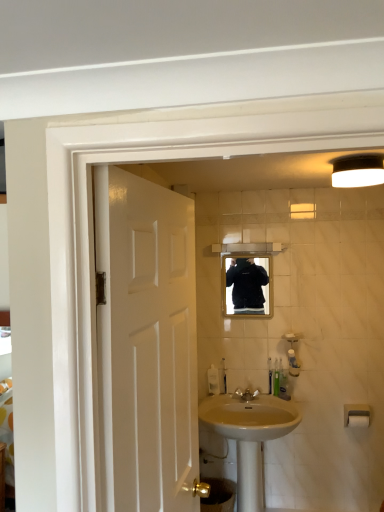
What do you see at coordinates (358, 419) in the screenshot?
I see `white plastic towel bar at lower right, which appears as the second towel bar when viewed from the top` at bounding box center [358, 419].

The width and height of the screenshot is (384, 512). What do you see at coordinates (223, 377) in the screenshot? I see `white plastic toothbrush at lower center, arranged as the fourth toiletry when viewed from the right` at bounding box center [223, 377].

The width and height of the screenshot is (384, 512). Describe the element at coordinates (276, 379) in the screenshot. I see `translucent plastic bottle at lower center, which appears as the third toiletry when viewed from the left` at that location.

Find the location of `translucent plastic bottle at lower center, which appears as the third toiletry when viewed from the left`. translucent plastic bottle at lower center, which appears as the third toiletry when viewed from the left is located at coordinates (276, 379).

This screenshot has height=512, width=384. Identify the location of white matte light fixture at upper right. (358, 170).

The image size is (384, 512). What do you see at coordinates (358, 170) in the screenshot?
I see `white matte light fixture at upper right` at bounding box center [358, 170].

Image resolution: width=384 pixels, height=512 pixels. Find the location of `green plastic toothbrush at center, the third toiletry when ordered from right to left`. green plastic toothbrush at center, the third toiletry when ordered from right to left is located at coordinates (270, 376).

Image resolution: width=384 pixels, height=512 pixels. Find the location of `matte black mirror at center`. matte black mirror at center is located at coordinates (247, 286).

Is white matte light fixture at upper right oriented away from matte black mirror at center?

No, white matte light fixture at upper right is not facing away from matte black mirror at center.

Is white matte light fixture at upper right spatially inside matte black mirror at center, or outside of it?

white matte light fixture at upper right is spatially situated outside matte black mirror at center.

Which object is further away from the camera taking this photo, white matte light fixture at upper right or matte black mirror at center?

matte black mirror at center is further away from the camera.

Does white matte light fixture at upper right have a greater height compared to matte black mirror at center?

Incorrect, the height of white matte light fixture at upper right is not larger of that of matte black mirror at center.

Is point (348, 409) more distant than point (275, 432)?

Yes.

From a real-world perspective, relative to beige ceramic sink at center, is white plastic towel bar at lower right, which is counted as the second towel bar, starting from the bottom, vertically above or below?

white plastic towel bar at lower right, which is counted as the second towel bar, starting from the bottom, is situated higher than beige ceramic sink at center in the real world.

From the image's perspective, which one is positioned higher, white plastic towel bar at lower right, which is counted as the second towel bar, starting from the bottom, or beige ceramic sink at center?

white plastic towel bar at lower right, which is counted as the second towel bar, starting from the bottom, from the image's perspective.

Considering the sizes of white plastic towel bar at lower right, positioned as the 1th towel bar in top-to-bottom order, and beige ceramic sink at center in the image, is white plastic towel bar at lower right, positioned as the 1th towel bar in top-to-bottom order, taller or shorter than beige ceramic sink at center?

white plastic towel bar at lower right, positioned as the 1th towel bar in top-to-bottom order, is shorter than beige ceramic sink at center.

Is green plastic toothbrush at center, the third toiletry when ordered from right to left, touching white plastic toothbrush at lower center, arranged as the fourth toiletry when viewed from the right?

green plastic toothbrush at center, the third toiletry when ordered from right to left, is not next to white plastic toothbrush at lower center, arranged as the fourth toiletry when viewed from the right, and they're not touching.

Does green plastic toothbrush at center, acting as the 2th toiletry starting from the left, appear on the right side of white plastic toothbrush at lower center, which is the first toiletry from left to right?

Yes.

Considering the sizes of objects green plastic toothbrush at center, acting as the 2th toiletry starting from the left, and white plastic toothbrush at lower center, arranged as the fourth toiletry when viewed from the right, in the image provided, who is thinner, green plastic toothbrush at center, acting as the 2th toiletry starting from the left, or white plastic toothbrush at lower center, arranged as the fourth toiletry when viewed from the right,?

With smaller width is white plastic toothbrush at lower center, arranged as the fourth toiletry when viewed from the right.

In terms of height, does green plastic toothbrush at center, the third toiletry when ordered from right to left, look taller or shorter compared to white plastic toothbrush at lower center, which is the first toiletry from left to right?

Clearly, green plastic toothbrush at center, the third toiletry when ordered from right to left, is taller compared to white plastic toothbrush at lower center, which is the first toiletry from left to right.

Is white plastic toothbrush at lower center, arranged as the fourth toiletry when viewed from the right, positioned before translucent plastic soap dispenser at sink?

Yes, white plastic toothbrush at lower center, arranged as the fourth toiletry when viewed from the right, is closer to the camera.

Do you think white plastic toothbrush at lower center, arranged as the fourth toiletry when viewed from the right, is within translucent plastic soap dispenser at sink, or outside of it?

white plastic toothbrush at lower center, arranged as the fourth toiletry when viewed from the right, lies outside translucent plastic soap dispenser at sink.

Is white plastic toothbrush at lower center, arranged as the fourth toiletry when viewed from the right, at the right side of translucent plastic soap dispenser at sink?

Indeed, white plastic toothbrush at lower center, arranged as the fourth toiletry when viewed from the right, is positioned on the right side of translucent plastic soap dispenser at sink.

From a real-world perspective, is white plastic toothbrush at lower center, arranged as the fourth toiletry when viewed from the right, beneath translucent plastic soap dispenser at sink?

No, from a real-world perspective, white plastic toothbrush at lower center, arranged as the fourth toiletry when viewed from the right, is not beneath translucent plastic soap dispenser at sink.

Considering the sizes of matte black mirror at center and translucent plastic bottle at lower center, which appears as the third toiletry when viewed from the left, in the image, is matte black mirror at center wider or thinner than translucent plastic bottle at lower center, which appears as the third toiletry when viewed from the left,?

matte black mirror at center is thinner than translucent plastic bottle at lower center, which appears as the third toiletry when viewed from the left.

Is point (247, 266) behind point (277, 372)?

Yes, point (247, 266) is behind point (277, 372).

Could you measure the distance between matte black mirror at center and translucent plastic bottle at lower center, which appears as the third toiletry when viewed from the left?

matte black mirror at center is 20.57 inches from translucent plastic bottle at lower center, which appears as the third toiletry when viewed from the left.

From a real-world perspective, who is located lower, white plastic towel bar at lower right, which is the 1th towel bar in bottom-to-top order, or translucent plastic bottle at lower center, which appears as the third toiletry when viewed from the left?

A: white plastic towel bar at lower right, which is the 1th towel bar in bottom-to-top order, is physically lower.

Measure the distance between white plastic towel bar at lower right, which appears as the second towel bar when viewed from the top, and translucent plastic bottle at lower center, placed as the second toiletry when sorted from right to left.

white plastic towel bar at lower right, which appears as the second towel bar when viewed from the top, and translucent plastic bottle at lower center, placed as the second toiletry when sorted from right to left, are 20.04 inches apart from each other.

From the picture: Who is bigger, white plastic towel bar at lower right, which is the 1th towel bar in bottom-to-top order, or translucent plastic bottle at lower center, placed as the second toiletry when sorted from right to left?

white plastic towel bar at lower right, which is the 1th towel bar in bottom-to-top order, is bigger.

Considering the relative positions of white plastic towel bar at lower right, positioned as the 1th towel bar in top-to-bottom order, and translucent plastic bottle at lower center, placed as the second toiletry when sorted from right to left, in the image provided, is white plastic towel bar at lower right, positioned as the 1th towel bar in top-to-bottom order, to the left of translucent plastic bottle at lower center, placed as the second toiletry when sorted from right to left, from the viewer's perspective?

Incorrect, white plastic towel bar at lower right, positioned as the 1th towel bar in top-to-bottom order, is not on the left side of translucent plastic bottle at lower center, placed as the second toiletry when sorted from right to left.

From the picture: Is white plastic towel bar at lower right, which is counted as the second towel bar, starting from the bottom, turned away from translucent plastic bottle at lower center, placed as the second toiletry when sorted from right to left?

white plastic towel bar at lower right, which is counted as the second towel bar, starting from the bottom, does not have its back to translucent plastic bottle at lower center, placed as the second toiletry when sorted from right to left.

Identify the location of the 1st towel bar directly beneath the translucent plastic bottle at lower center, which appears as the third toiletry when viewed from the left (from a real-world perspective). (356, 415).

Which object is further away from the camera, white plastic towel bar at lower right, which is counted as the second towel bar, starting from the bottom, or translucent plastic bottle at lower center, placed as the second toiletry when sorted from right to left?

translucent plastic bottle at lower center, placed as the second toiletry when sorted from right to left.

The width and height of the screenshot is (384, 512). I want to click on mirror lying on the left of white matte light fixture at upper right, so click(x=247, y=286).

The image size is (384, 512). I want to click on sink that is under the white plastic towel bar at lower right, which is counted as the second towel bar, starting from the bottom (from a real-world perspective), so 249,436.

Considering their positions, is green plastic toothbrush at center, acting as the 2th toiletry starting from the left, positioned closer to white glossy door at left than beige ceramic sink at center?

The object closer to white glossy door at left is beige ceramic sink at center.

Estimate the real-world distances between objects in this image. Which object is closer to white plastic toothbrush at lower center, which is the first toiletry from left to right, green plastic toothbrush at center, acting as the 2th toiletry starting from the left, or matte black mirror at center?

Among the two, green plastic toothbrush at center, acting as the 2th toiletry starting from the left, is located nearer to white plastic toothbrush at lower center, which is the first toiletry from left to right.

Based on their spatial positions, is white plastic towel bar at lower right, which appears as the second towel bar when viewed from the top, or white plastic toothbrush at lower center, arranged as the fourth toiletry when viewed from the right, closer to polished brass faucet at sink center?

white plastic toothbrush at lower center, arranged as the fourth toiletry when viewed from the right, lies closer to polished brass faucet at sink center than the other object.

From the image, which object appears to be nearer to white plastic towel bar at lower right, which is the 1th towel bar in bottom-to-top order, translucent plastic soap dispenser at sink or white matte light fixture at upper right?

translucent plastic soap dispenser at sink.

Looking at the image, which one is located further to green plastic toothbrush at center, the third toiletry when ordered from right to left, white glossy door at left or translucent plastic bottle at lower center, which appears as the third toiletry when viewed from the left?

white glossy door at left lies further to green plastic toothbrush at center, the third toiletry when ordered from right to left, than the other object.

Considering their positions, is white glossy door at left positioned closer to white matte light fixture at upper right than green plastic toothbrush at center, the third toiletry when ordered from right to left?

white glossy door at left lies closer to white matte light fixture at upper right than the other object.

Based on their spatial positions, is green plastic toothbrush at center, acting as the 2th toiletry starting from the left, or white glossy door at left closer to white plastic toothbrush at lower center, which is the first toiletry from left to right?

green plastic toothbrush at center, acting as the 2th toiletry starting from the left, lies closer to white plastic toothbrush at lower center, which is the first toiletry from left to right, than the other object.

Considering their positions, is matte black mirror at center positioned closer to white plastic toothbrush at lower center, which is the first toiletry from left to right, than translucent plastic soap dispenser at sink?

Based on the image, translucent plastic soap dispenser at sink appears to be nearer to white plastic toothbrush at lower center, which is the first toiletry from left to right.

Where is `tap between white matte light fixture at upper right and white plastic towel bar at lower right, which is the 1th towel bar in bottom-to-top order, in the up-down direction`? The image size is (384, 512). tap between white matte light fixture at upper right and white plastic towel bar at lower right, which is the 1th towel bar in bottom-to-top order, in the up-down direction is located at coordinates (245, 394).

At what (x,y) coordinates should I click in order to perform the action: click on light fixture between white glossy door at left and white plastic towel bar at lower right, which is the 1th towel bar in bottom-to-top order, in the front-back direction. Please return your answer as a coordinate pair (x, y). The image size is (384, 512). Looking at the image, I should click on (358, 170).

Where is `tap located between beige ceramic sink at center and white plastic towel bar at lower right, which is the 1th towel bar in bottom-to-top order, in the left-right direction`? tap located between beige ceramic sink at center and white plastic towel bar at lower right, which is the 1th towel bar in bottom-to-top order, in the left-right direction is located at coordinates (245, 394).

The height and width of the screenshot is (512, 384). I want to click on soap dispenser between matte black mirror at center and beige ceramic sink at center vertically, so click(213, 380).